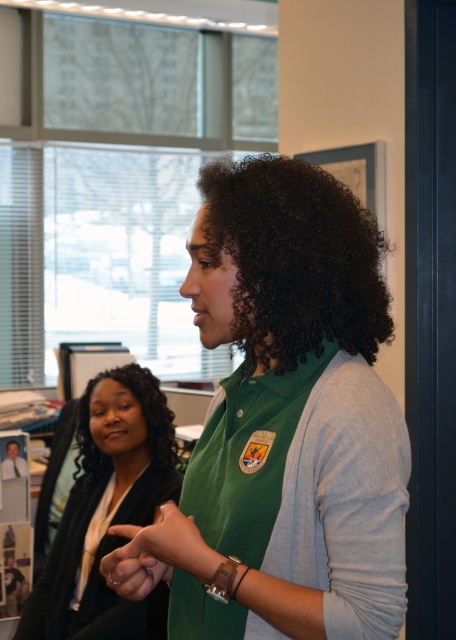
Question: Is green matte vest at center further to the viewer compared to silver metallic ring at center?

Choices:
 (A) no
 (B) yes

Answer: (A)

Question: Does green matte vest at center have a lesser width compared to matte black jacket at left?

Choices:
 (A) yes
 (B) no

Answer: (A)

Question: Which is nearer to the matte black jacket at left?

Choices:
 (A) smooth skin hand at center
 (B) dark curly hair at center
 (C) silver metallic ring at center

Answer: (C)

Question: Which point is farther from the camera taking this photo?

Choices:
 (A) (342, 481)
 (B) (125, 593)
 (C) (202, 556)
 (D) (155, 596)

Answer: (D)

Question: Which of these objects is positioned closest to the silver metallic ring at center?

Choices:
 (A) green matte vest at center
 (B) black curly hair at lower left
 (C) dark curly hair at center
 (D) matte black jacket at left

Answer: (A)

Question: Does green matte vest at center have a lesser width compared to matte black jacket at left?

Choices:
 (A) yes
 (B) no

Answer: (A)